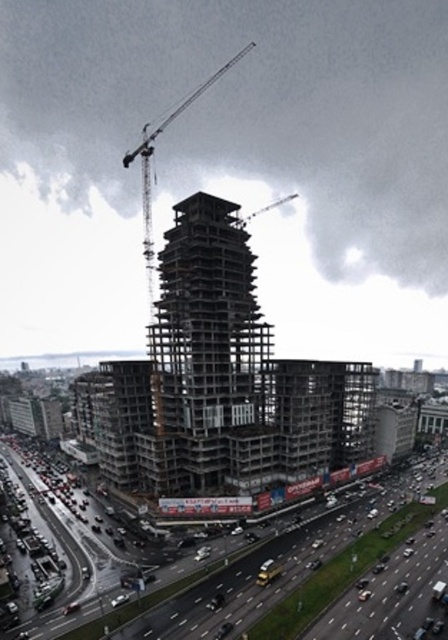
Can you confirm if asphalt road at center is positioned to the left of metallic gray crane at center?

Incorrect, asphalt road at center is not on the left side of metallic gray crane at center.

Does point (345, 584) come behind point (154, 138)?

No.

Is point (222, 588) closer to camera compared to point (146, 148)?

Yes.

Find the location of `asphalt road at center`. asphalt road at center is located at coordinates (280, 572).

Between point (237, 307) and point (153, 138), which one is positioned in front?

Point (237, 307) is more forward.

Is concrete structure at center bigger than metallic gray crane at center?

Incorrect, concrete structure at center is not larger than metallic gray crane at center.

What do you see at coordinates (210, 353) in the screenshot?
I see `concrete structure at center` at bounding box center [210, 353].

Identify the location of concrete structure at center. coord(210,353).

Can you confirm if concrete structure at center is shorter than asphalt road at center?

No, concrete structure at center is not shorter than asphalt road at center.

From the picture: Is concrete structure at center smaller than asphalt road at center?

Actually, concrete structure at center might be larger than asphalt road at center.

Describe the element at coordinates (210, 353) in the screenshot. I see `concrete structure at center` at that location.

At what (x,y) coordinates should I click in order to perform the action: click on concrete structure at center. Please return your answer as a coordinate pair (x, y). Image resolution: width=448 pixels, height=640 pixels. Looking at the image, I should click on (210, 353).